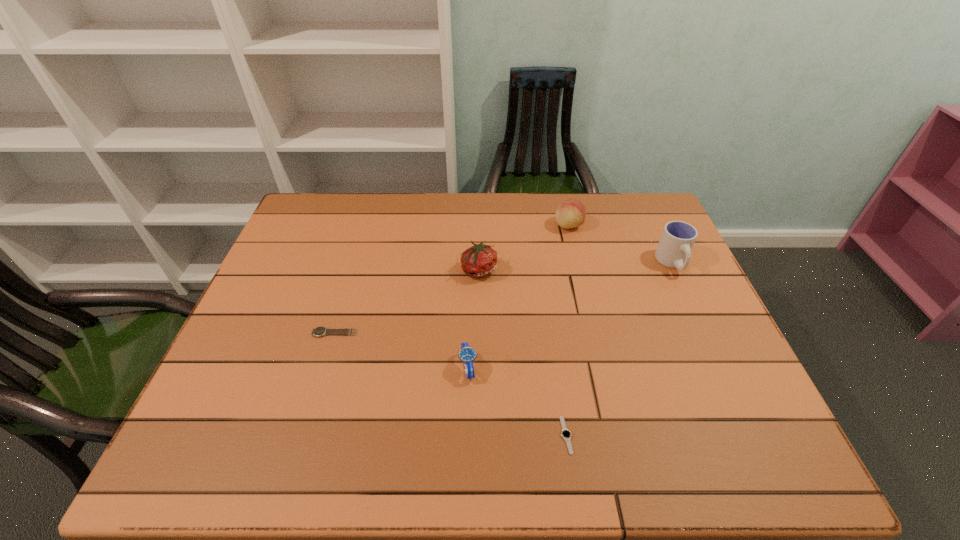
The image size is (960, 540). I want to click on vacant space at the far edge of the desktop, so click(x=441, y=235).

Where is `free space at the near edge of the desktop`? This screenshot has height=540, width=960. free space at the near edge of the desktop is located at coordinates (610, 456).

This screenshot has width=960, height=540. Find the location of `vacant space at the left edge of the desktop`. vacant space at the left edge of the desktop is located at coordinates (305, 307).

I want to click on vacant area at the right edge of the desktop, so click(671, 268).

This screenshot has height=540, width=960. Identify the location of vacant space at the far left corner of the desktop. (340, 233).

You are a GUI agent. You are given a task and a screenshot of the screen. Output one action in this format:
    pyautogui.click(x=<x>, y=<y>)
    Task: Click on the free space at the far right corner
    Image resolution: width=960 pixels, height=540 pixels.
    Given the screenshot: What is the action you would take?
    pyautogui.click(x=639, y=220)

At what (x,y) coordinates should I click in order to perform the action: click on vacant point located between the tallest object and the second shortest object. Please return your answer as a coordinate pair (x, y). Looking at the image, I should click on (503, 298).

You are a GUI agent. You are given a task and a screenshot of the screen. Output one action in this format:
    pyautogui.click(x=<x>, y=<y>)
    Task: Click on the unoccupied area between the rightmost object and the leftmost object
    Image resolution: width=960 pixels, height=540 pixels.
    Given the screenshot: What is the action you would take?
    pyautogui.click(x=503, y=298)

At what (x,y) coordinates should I click in order to perform the action: click on vacant region between the fifth tallest object and the second watch from left to right. Please return your answer as a coordinate pair (x, y). Looking at the image, I should click on (401, 350).

Image resolution: width=960 pixels, height=540 pixels. Find the location of `vacant space that is in between the second nearest watch and the farthest watch`. vacant space that is in between the second nearest watch and the farthest watch is located at coordinates (401, 350).